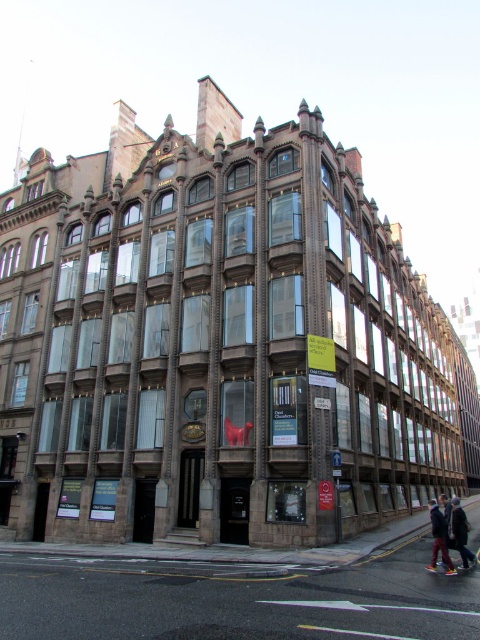
Is leather jacket at lower right thinner than matte red cross at center?

In fact, leather jacket at lower right might be wider than matte red cross at center.

Where is `leather jacket at lower right`? The height and width of the screenshot is (640, 480). leather jacket at lower right is located at coordinates (439, 540).

Image resolution: width=480 pixels, height=640 pixels. What do you see at coordinates (439, 540) in the screenshot? I see `leather jacket at lower right` at bounding box center [439, 540].

At what (x,y) coordinates should I click in order to perform the action: click on leather jacket at lower right. Please return your answer as a coordinate pair (x, y). Looking at the image, I should click on (439, 540).

Between leather jacket at lower right and dark blue jeans at lower right, which one has more height?

dark blue jeans at lower right

Between point (432, 522) and point (464, 529), which one is positioned in front?

Point (464, 529) is more forward.

Between point (442, 518) and point (453, 536), which one is positioned in front?

Point (453, 536)

You are a GUI agent. You are given a task and a screenshot of the screen. Output one action in this format:
    pyautogui.click(x=<x>, y=<y>)
    Task: Click on the leather jacket at lower right
    This screenshot has height=640, width=480.
    Given the screenshot: What is the action you would take?
    pyautogui.click(x=439, y=540)

Does dark blue jeans at lower right have a larger size compared to matte red cross at center?

Yes, dark blue jeans at lower right is bigger than matte red cross at center.

Where is `dark blue jeans at lower right`? Image resolution: width=480 pixels, height=640 pixels. dark blue jeans at lower right is located at coordinates (459, 531).

The height and width of the screenshot is (640, 480). What do you see at coordinates (459, 531) in the screenshot?
I see `dark blue jeans at lower right` at bounding box center [459, 531].

Find the location of a particular element. dark blue jeans at lower right is located at coordinates (459, 531).